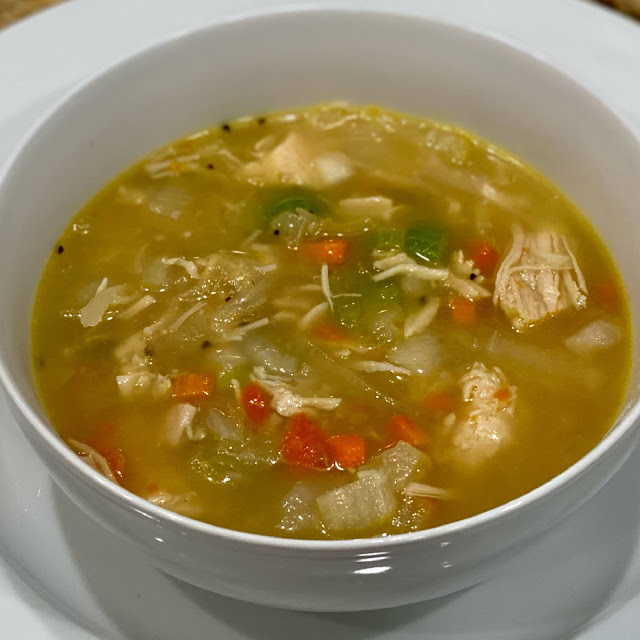
Identify the location of top rim of bowl. The image size is (640, 640). (600, 45), (47, 54).